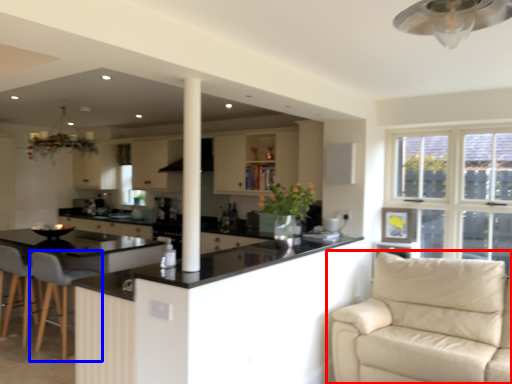
Question: Among these objects, which one is nearest to the camera, studio couch (highlighted by a red box) or chair (highlighted by a blue box)?

Choices:
 (A) studio couch
 (B) chair

Answer: (A)